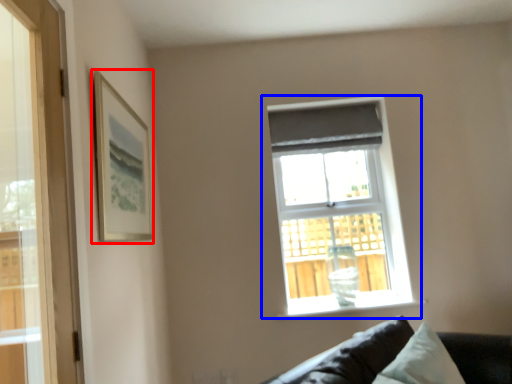
Question: Which of the following is the farthest to the observer, picture frame (highlighted by a red box) or window (highlighted by a blue box)?

Choices:
 (A) picture frame
 (B) window

Answer: (B)